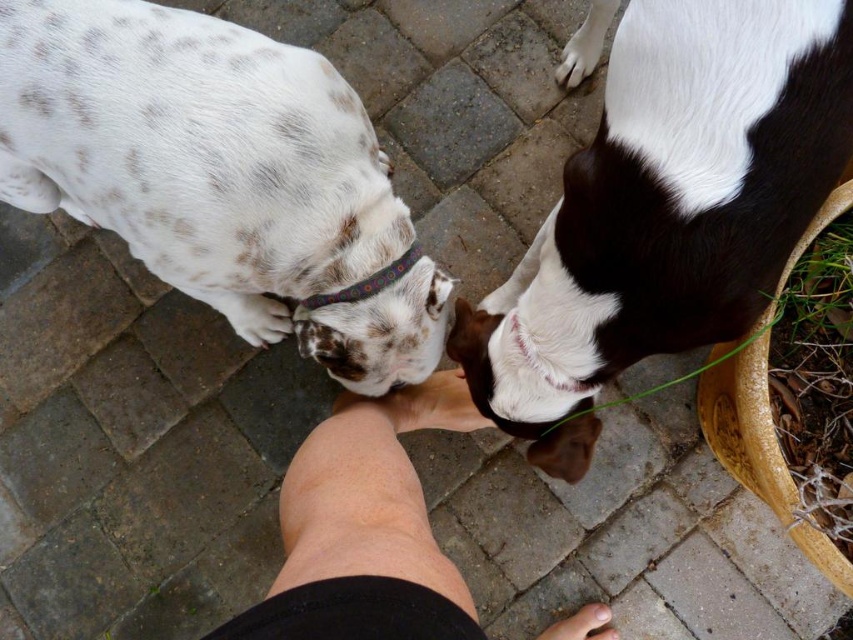
You are a photographer trying to capture a photo of the white and brown fur at lower right and the skinny leg at center. Since you want to ensure both are in focus, which object should you adjust your camera focus on first considering their sizes?

The white and brown fur at lower right is bigger than the skinny leg at center, so you should focus on the white and brown fur at lower right first to ensure proper focus on the larger object.

You are a dog trainer observing two dogs in a park. You notice a spotted fur at center and a multicolored fabric neckband at center. Which object is larger?

The spotted fur at center is bigger than the multicolored fabric neckband at center.